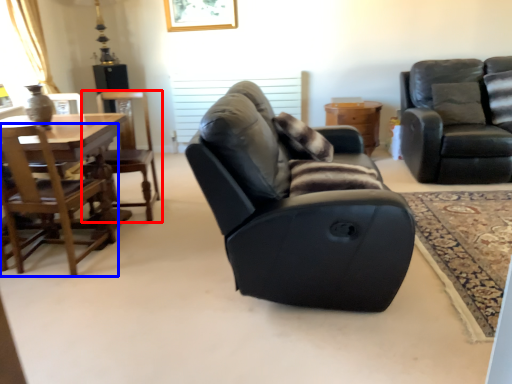
Question: Which point is further to the camera, chair (highlighted by a red box) or chair (highlighted by a blue box)?

Choices:
 (A) chair
 (B) chair

Answer: (A)